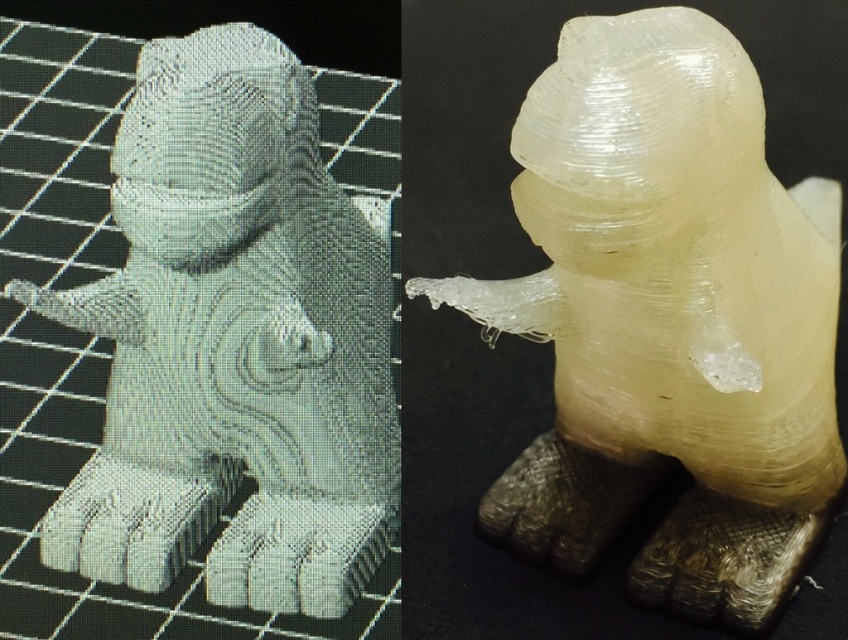
Question: Which of the following is the closest to the observer?

Choices:
 (A) translucent white sculpture at center
 (B) white glossy statue at center

Answer: (A)

Question: Among these objects, which one is farthest from the camera?

Choices:
 (A) white glossy statue at center
 (B) translucent white sculpture at center

Answer: (A)

Question: Can you confirm if translucent white sculpture at center is smaller than white glossy statue at center?

Choices:
 (A) no
 (B) yes

Answer: (A)

Question: Does translucent white sculpture at center have a smaller size compared to white glossy statue at center?

Choices:
 (A) no
 (B) yes

Answer: (A)

Question: Does translucent white sculpture at center have a larger size compared to white glossy statue at center?

Choices:
 (A) yes
 (B) no

Answer: (A)